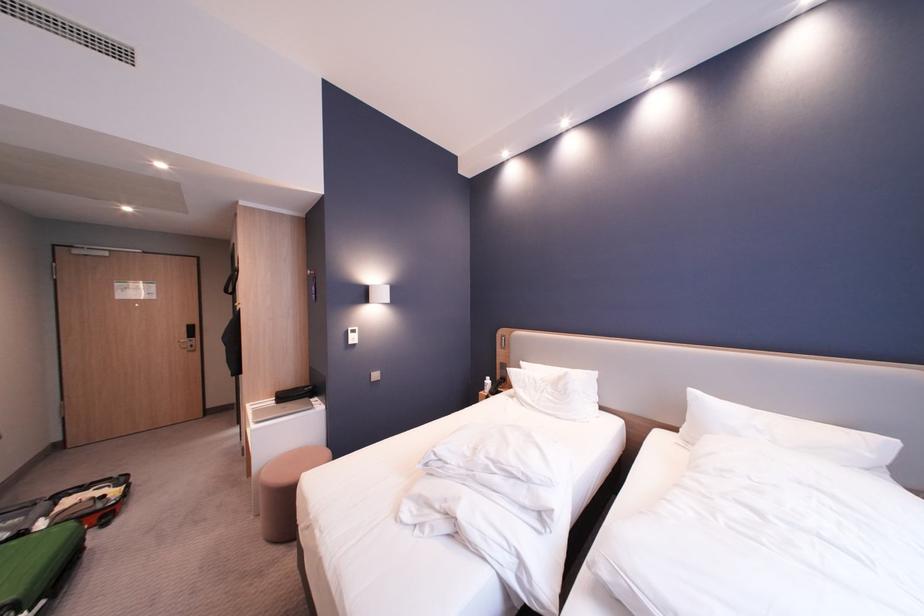
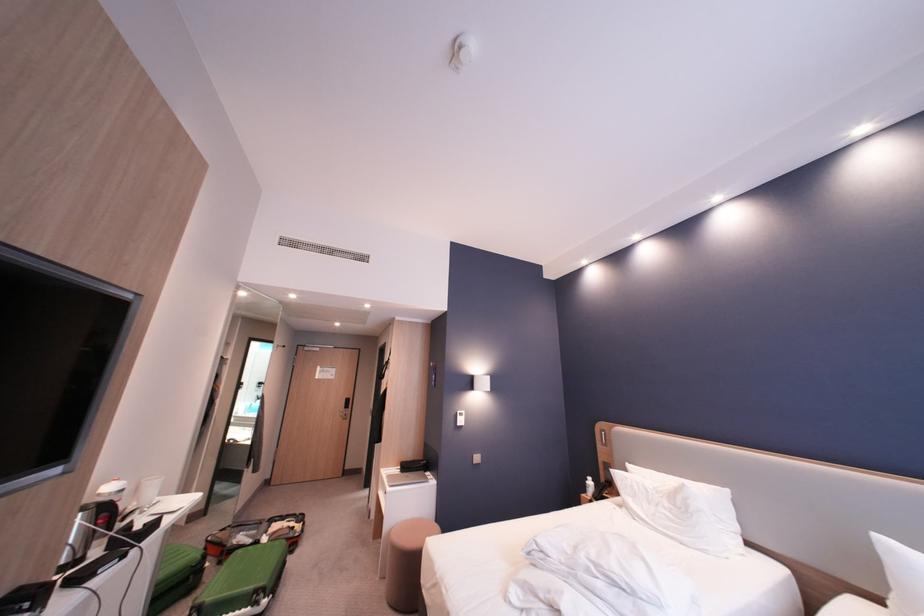
Question: In a continuous first-person perspective shot, in which direction is the camera moving?

Choices:
 (A) Left
 (B) Right
 (C) Forward
 (D) Backward

Answer: (D)